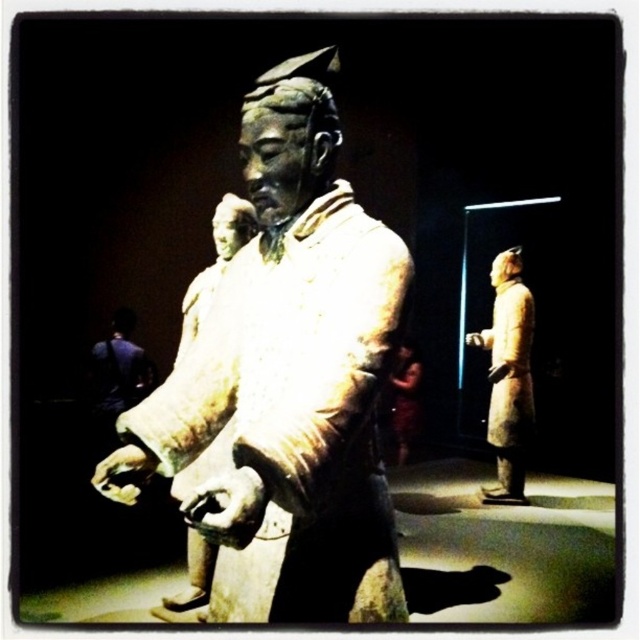
Does smooth bronze hand at center appear over smooth clay hand at center?

Yes, smooth bronze hand at center is above smooth clay hand at center.

Which is above, smooth bronze hand at center or smooth clay hand at center?

smooth bronze hand at center

Is point (252, 513) more distant than point (124, 452)?

No.

Image resolution: width=640 pixels, height=640 pixels. I want to click on smooth bronze hand at center, so click(227, 508).

Measure the distance between matte bronze warrior at center and camera.

matte bronze warrior at center and camera are 3.67 feet apart.

Can you confirm if matte bronze warrior at center is thinner than smooth bronze hand at center?

In fact, matte bronze warrior at center might be wider than smooth bronze hand at center.

Who is more distant from viewer, [284,92] or [253,506]?

Point [284,92]

Where is `matte bronze warrior at center`? matte bronze warrior at center is located at coordinates (292, 372).

Which of these two, matte gray figure at right or smooth clay hand at center, stands taller?

matte gray figure at right is taller.

Which of these two, matte gray figure at right or smooth clay hand at center, stands shorter?

With less height is smooth clay hand at center.

What are the coordinates of `matte gray figure at right` in the screenshot? It's located at (508, 376).

At what (x,y) coordinates should I click in order to perform the action: click on matte gray figure at right. Please return your answer as a coordinate pair (x, y). This screenshot has width=640, height=640. Looking at the image, I should click on (508, 376).